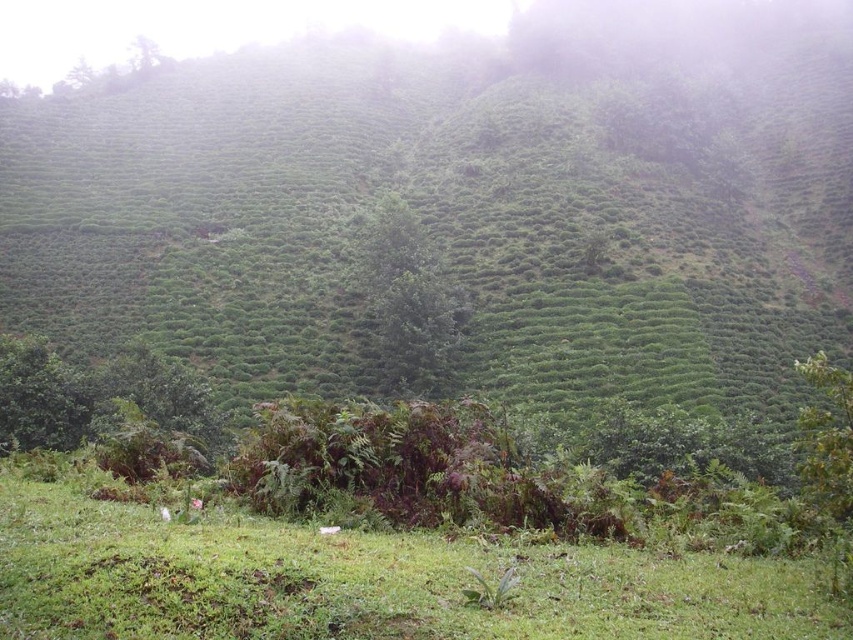
You are standing at the point labeled point (x=460, y=211) in the image. Based on the scene description, what type of terrain or vegetation are you most likely standing on?

You are most likely standing on the green leafy hillside at center, as the point (x=460, y=211) corresponds to that area according to the description.

You are a drone operator trying to navigate between two points on a hillside. You see the point at (242,220) and the point at (474,637). Which point is closer to your current position?

Point at (242,220) is closer to your current position because it is further to the viewer than point at (474,637).

You are a landscape architect planning to install a new walking path. You notice the green leafy hillside at center and the green grassy at lower center. Which area would be more suitable for placing the path based on their sizes?

The green grassy at lower center is smaller in size compared to the green leafy hillside at center, so the green grassy at lower center would be more suitable for placing the path as it requires less disturbance to the larger hillside area.